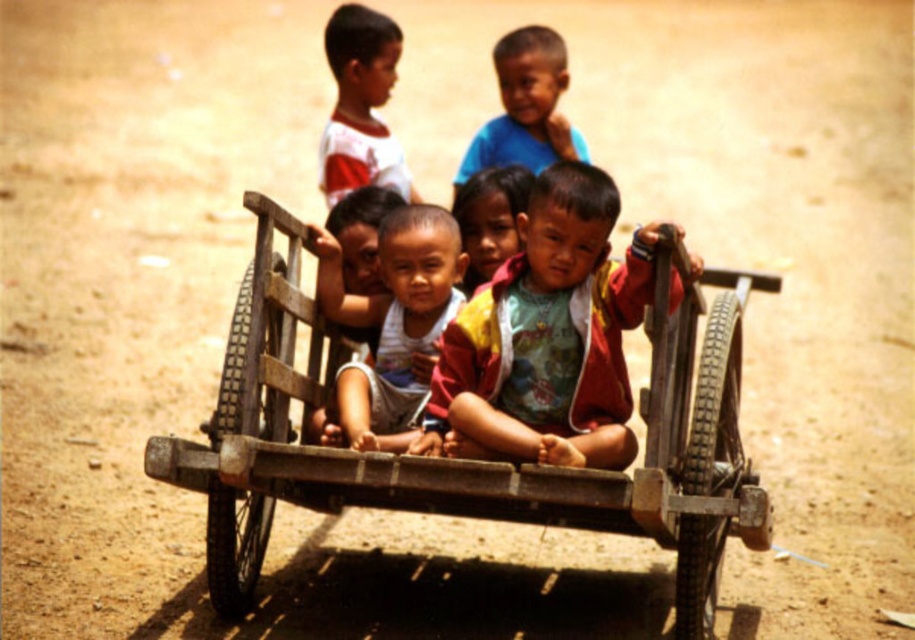
Which is above, wooden cart at center or smooth skin boy at center?

smooth skin boy at center is higher up.

What do you see at coordinates (469, 460) in the screenshot? The image size is (915, 640). I see `wooden cart at center` at bounding box center [469, 460].

Identify the location of wooden cart at center. The height and width of the screenshot is (640, 915). (469, 460).

Is wooden cart at center positioned before matte white shirt at center?

Yes, it is in front of matte white shirt at center.

Who is more forward, (278,376) or (394,368)?

Point (278,376)

Who is more forward, (253, 525) or (438, 314)?

Point (253, 525) is in front.

Image resolution: width=915 pixels, height=640 pixels. I want to click on wooden cart at center, so click(x=469, y=460).

Does white cotton shirt at upper left have a larger size compared to matte skin child at center?

Correct, white cotton shirt at upper left is larger in size than matte skin child at center.

Which is more to the left, white cotton shirt at upper left or matte skin child at center?

white cotton shirt at upper left

Describe the element at coordinates (361, 106) in the screenshot. This screenshot has height=640, width=915. I see `white cotton shirt at upper left` at that location.

Where is `white cotton shirt at upper left`? The height and width of the screenshot is (640, 915). white cotton shirt at upper left is located at coordinates (361, 106).